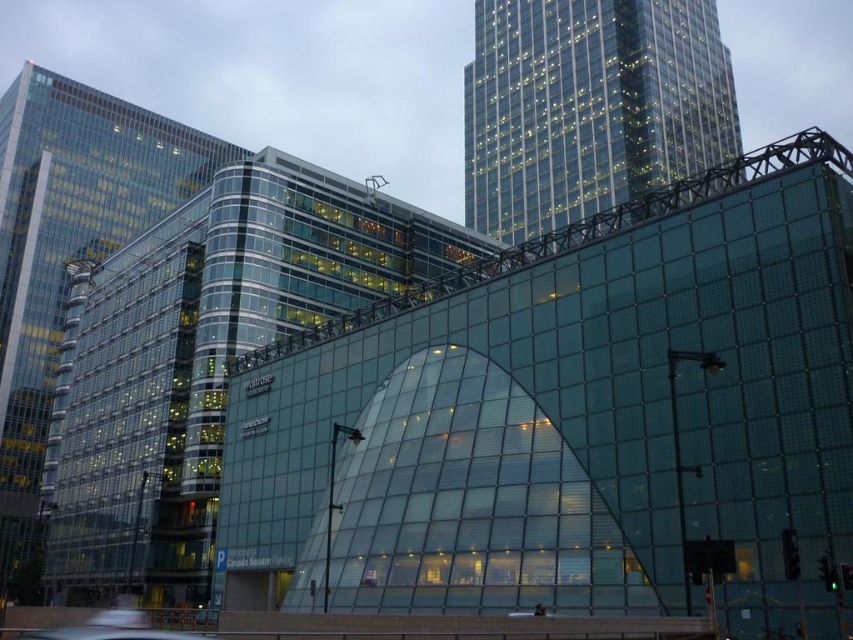
Who is taller, transparent glass skyscraper at upper center or transparent glass building at left?

transparent glass building at left is taller.

Between point (535, 211) and point (144, 200), which one is positioned behind?

The point (144, 200) is more distant.

Where is `transparent glass skyscraper at upper center`? transparent glass skyscraper at upper center is located at coordinates (589, 106).

Does transparent glass building at center have a greater width compared to transparent glass building at left?

Indeed, transparent glass building at center has a greater width compared to transparent glass building at left.

Is transparent glass building at center thinner than transparent glass building at left?

In fact, transparent glass building at center might be wider than transparent glass building at left.

Image resolution: width=853 pixels, height=640 pixels. What are the coordinates of `transparent glass building at center` in the screenshot? It's located at (206, 358).

Can you confirm if transparent glass building at center is smaller than transparent glass skyscraper at upper center?

Yes.

Is transparent glass building at center shorter than transparent glass skyscraper at upper center?

Indeed, transparent glass building at center has a lesser height compared to transparent glass skyscraper at upper center.

Where is `transparent glass building at center`? The width and height of the screenshot is (853, 640). transparent glass building at center is located at coordinates (206, 358).